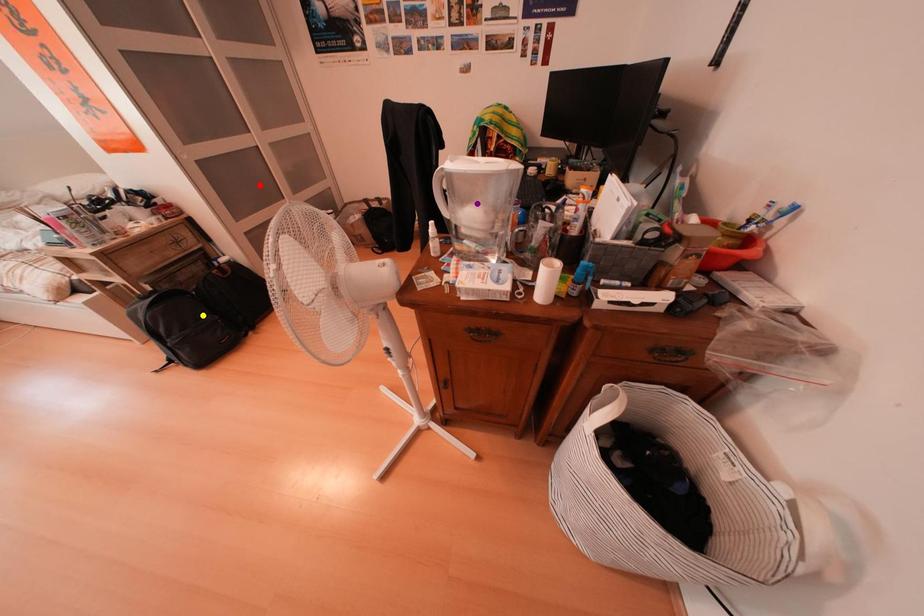
Order these from nearest to farthest:
yellow point | purple point | red point

1. yellow point
2. purple point
3. red point